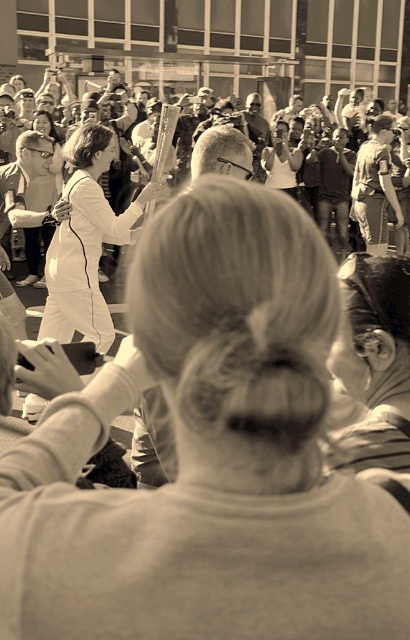
Who is shorter, white smooth dress at center or metallic torch at center?

white smooth dress at center

Which is behind, point (82, 150) or point (268, 161)?

The point (268, 161) is behind.

I want to click on white smooth dress at center, so click(x=86, y=243).